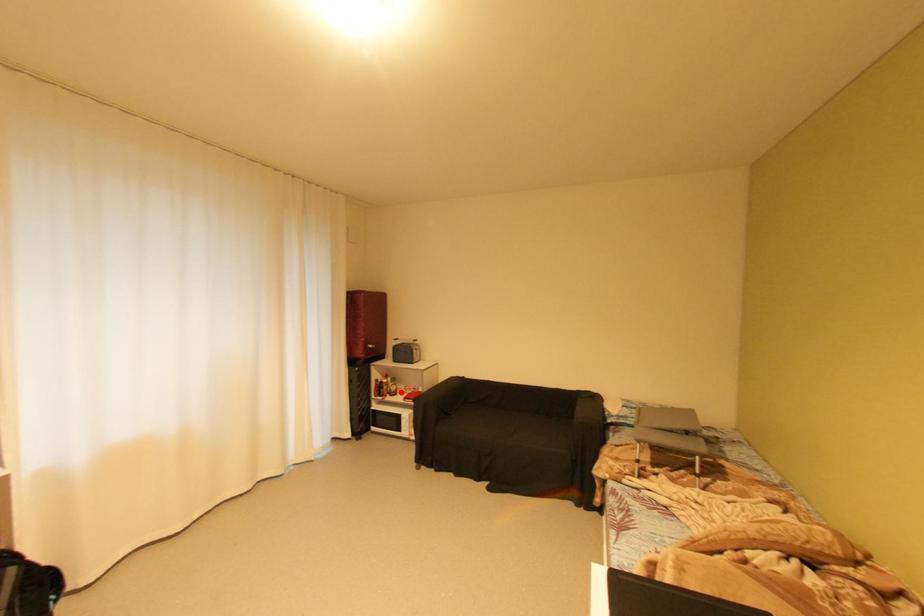
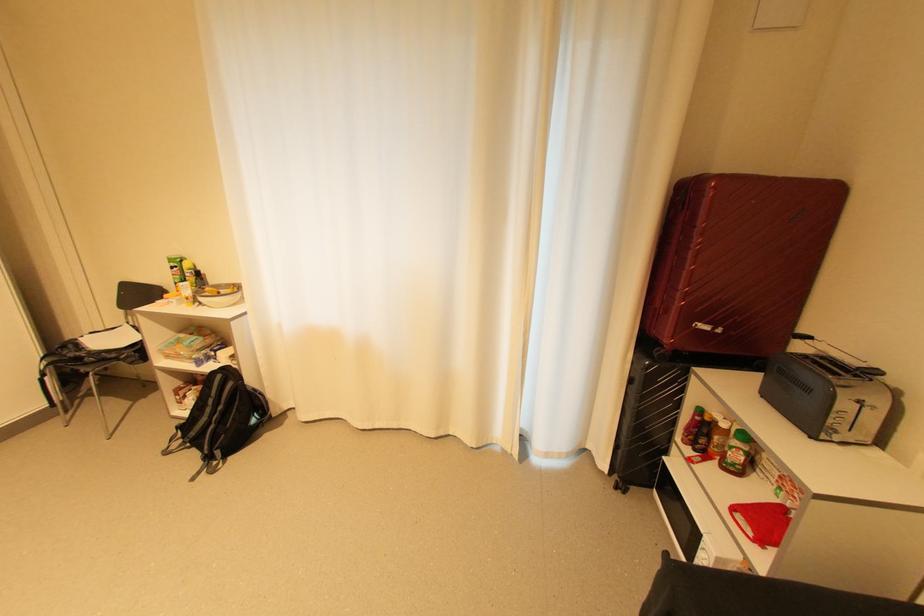
The point at the highlighted location is marked in the first image. Where is the corresponding point in the second image?

(739, 466)